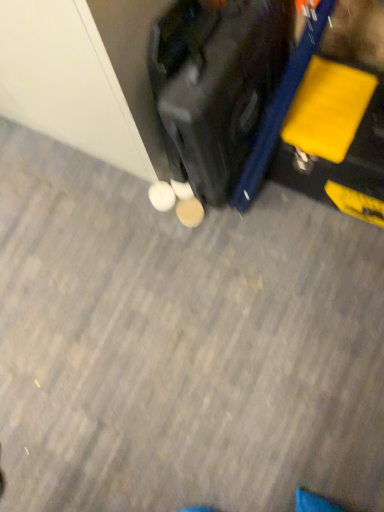
Question: In which direction should I rotate to look at white matte shoe at center, which ranks as the 2th footwear in left-to-right order?

Choices:
 (A) left
 (B) right

Answer: (A)

Question: In which direction should I rotate to look at white matte shoe at center, positioned as the second footwear in right-to-left order?

Choices:
 (A) right
 (B) left

Answer: (B)

Question: Can you confirm if white matte shoe at center, which is the first footwear in left-to-right order, is positioned to the left of shiny black suitcase at center?

Choices:
 (A) yes
 (B) no

Answer: (A)

Question: Can you confirm if white matte shoe at center, which is the first footwear in left-to-right order, is taller than shiny black suitcase at center?

Choices:
 (A) yes
 (B) no

Answer: (B)

Question: Is white matte shoe at center, positioned as the second footwear in right-to-left order, positioned behind shiny black suitcase at center?

Choices:
 (A) yes
 (B) no

Answer: (A)

Question: From a real-world perspective, is white matte shoe at center, which is the first footwear in left-to-right order, under shiny black suitcase at center?

Choices:
 (A) no
 (B) yes

Answer: (B)

Question: Is white matte shoe at center, positioned as the second footwear in right-to-left order, oriented away from shiny black suitcase at center?

Choices:
 (A) yes
 (B) no

Answer: (A)

Question: Is white matte shoe at center, positioned as the second footwear in right-to-left order, positioned beyond the bounds of shiny black suitcase at center?

Choices:
 (A) yes
 (B) no

Answer: (A)

Question: Is shiny black suitcase at center to the right of white matte shoe at center, positioned as the second footwear in right-to-left order, from the viewer's perspective?

Choices:
 (A) yes
 (B) no

Answer: (A)

Question: Considering the relative sizes of shiny black suitcase at center and white matte shoe at center, positioned as the second footwear in right-to-left order, in the image provided, is shiny black suitcase at center wider than white matte shoe at center, positioned as the second footwear in right-to-left order,?

Choices:
 (A) yes
 (B) no

Answer: (A)

Question: Is shiny black suitcase at center directly adjacent to white matte shoe at center, positioned as the second footwear in right-to-left order?

Choices:
 (A) no
 (B) yes

Answer: (A)

Question: Would you say shiny black suitcase at center is outside white matte shoe at center, positioned as the second footwear in right-to-left order?

Choices:
 (A) yes
 (B) no

Answer: (A)

Question: Does shiny black suitcase at center have a greater height compared to white matte shoe at center, which is the first footwear in left-to-right order?

Choices:
 (A) no
 (B) yes

Answer: (B)

Question: Is shiny black suitcase at center facing away from white matte shoe at center, positioned as the second footwear in right-to-left order?

Choices:
 (A) yes
 (B) no

Answer: (B)

Question: From a real-world perspective, is white matte shoe at center, which ranks as the 2th footwear in left-to-right order, on white matte shoe at center, which is the first footwear in left-to-right order?

Choices:
 (A) no
 (B) yes

Answer: (A)